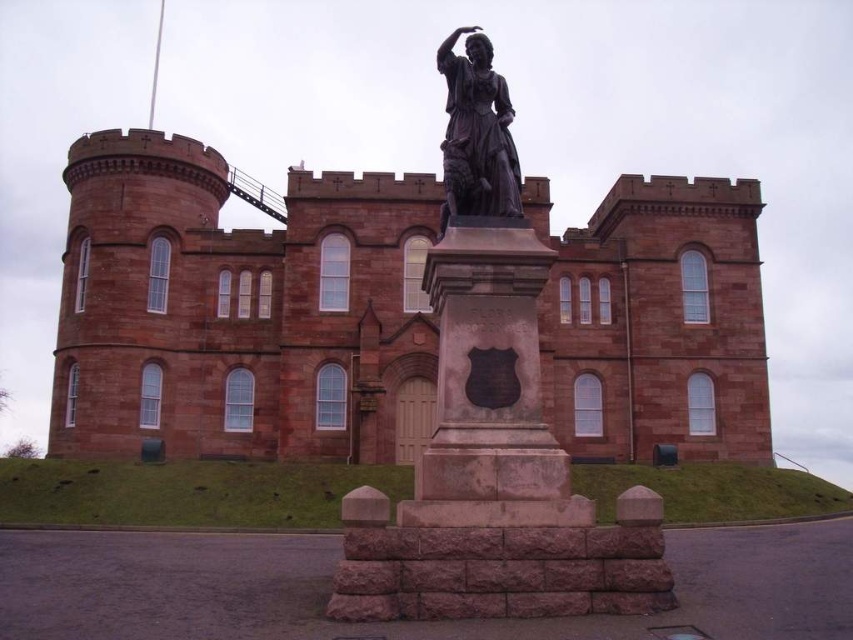
Does red stone castle at center have a smaller size compared to bronze statue at center?

Incorrect, red stone castle at center is not smaller in size than bronze statue at center.

In the scene shown: Between red stone castle at center and bronze statue at center, which one is positioned lower?

Answer: red stone castle at center

Who is more distant from viewer, (132, 371) or (477, 104)?

Positioned behind is point (132, 371).

You are a GUI agent. You are given a task and a screenshot of the screen. Output one action in this format:
    pyautogui.click(x=<x>, y=<y>)
    Task: Click on the red stone castle at center
    This screenshot has width=853, height=640.
    Given the screenshot: What is the action you would take?
    pyautogui.click(x=241, y=310)